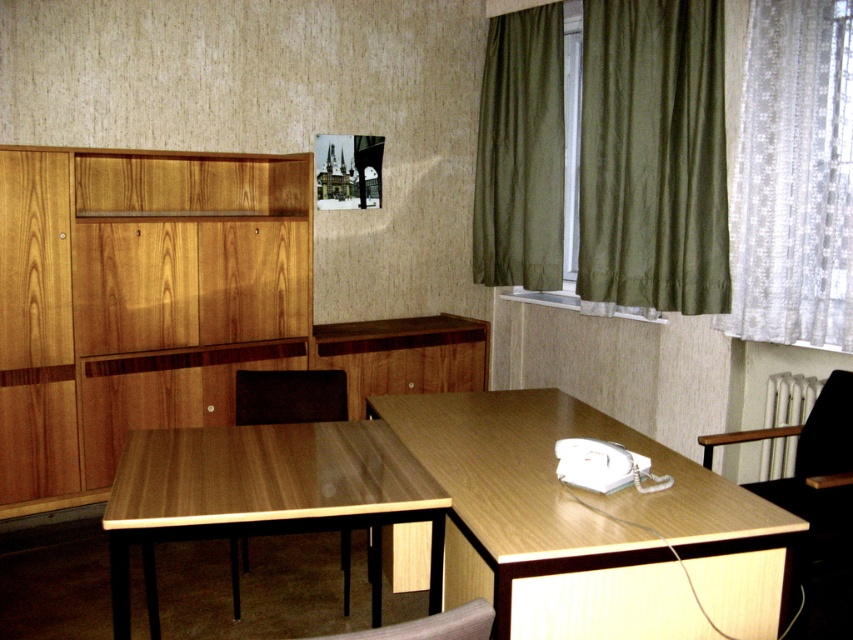
Is olive green fabric curtain at upper right shorter than leather-like swivel chair at lower center?

No, olive green fabric curtain at upper right is not shorter than leather-like swivel chair at lower center.

Which of these two, olive green fabric curtain at upper right or leather-like swivel chair at lower center, stands shorter?

Standing shorter between the two is leather-like swivel chair at lower center.

Which is in front, point (558, 157) or point (453, 630)?

Point (453, 630)

This screenshot has height=640, width=853. Identify the location of olive green fabric curtain at upper right. (520, 152).

Which is behind, point (480, 472) or point (289, 404)?

The point (289, 404) is behind.

From the picture: Which is more to the left, wooden table at lower right or brown leather chair at center?

brown leather chair at center is more to the left.

What do you see at coordinates (589, 525) in the screenshot? The width and height of the screenshot is (853, 640). I see `wooden table at lower right` at bounding box center [589, 525].

You are a GUI agent. You are given a task and a screenshot of the screen. Output one action in this format:
    pyautogui.click(x=<x>, y=<y>)
    Task: Click on the wooden table at lower right
    
    Given the screenshot: What is the action you would take?
    [589, 525]

Is the position of olive green fabric curtain at right less distant than that of wooden table at center?

No, olive green fabric curtain at right is behind wooden table at center.

Is olive green fabric curtain at right shorter than wooden table at center?

No.

This screenshot has width=853, height=640. What do you see at coordinates (653, 156) in the screenshot?
I see `olive green fabric curtain at right` at bounding box center [653, 156].

I want to click on olive green fabric curtain at right, so point(653,156).